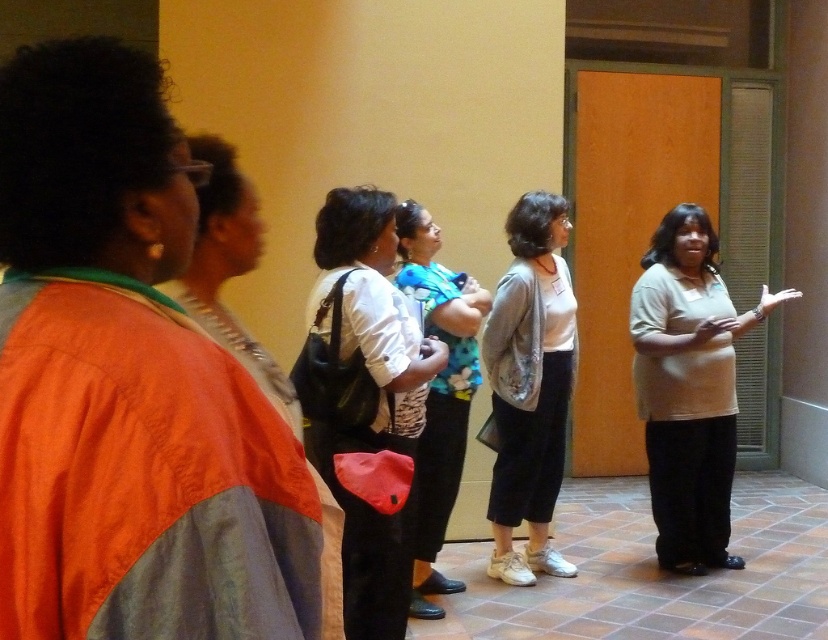
You are standing in the hallway and want to move towards the wooden door with a metal grille on the right. There are two points marked in the image, point (544, 314) and point (402, 257). Which point should you aim for to get closer to the door?

Point (544, 314) is further to the camera than point (402, 257). Therefore, to get closer to the wooden door with a metal grille on the right, you should aim for point (402, 257) since it is closer to the door.

You are a photographer trying to capture a candid shot of the white fabric shirt at center and the gray sweater at center in the scene. Since you want to ensure both subjects are fully visible in the frame, which clothing item should you focus on first to adjust your camera angle?

The white fabric shirt at center is shorter than the gray sweater at center, so you should focus on adjusting the camera angle to ensure the shorter white fabric shirt at center is fully visible first.